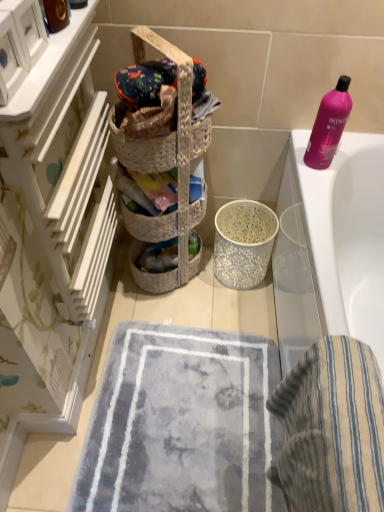
Question: Is white wood drawers at left located outside white glossy bathtub at upper right?

Choices:
 (A) yes
 (B) no

Answer: (A)

Question: From the image's perspective, is white wood drawers at left on white glossy bathtub at upper right?

Choices:
 (A) yes
 (B) no

Answer: (A)

Question: Can you confirm if white wood drawers at left is bigger than white glossy bathtub at upper right?

Choices:
 (A) yes
 (B) no

Answer: (B)

Question: From a real-world perspective, is white wood drawers at left under white glossy bathtub at upper right?

Choices:
 (A) no
 (B) yes

Answer: (A)

Question: Is there a large distance between white wood drawers at left and white glossy bathtub at upper right?

Choices:
 (A) yes
 (B) no

Answer: (B)

Question: Is white wood drawers at left next to white glossy bathtub at upper right and touching it?

Choices:
 (A) yes
 (B) no

Answer: (B)

Question: From the image's perspective, is pink plastic bottle at upper right over woven straw basket at center?

Choices:
 (A) yes
 (B) no

Answer: (A)

Question: From the image's perspective, would you say pink plastic bottle at upper right is shown under woven straw basket at center?

Choices:
 (A) no
 (B) yes

Answer: (A)

Question: Can you confirm if pink plastic bottle at upper right is taller than woven straw basket at center?

Choices:
 (A) no
 (B) yes

Answer: (B)

Question: Can you confirm if pink plastic bottle at upper right is wider than woven straw basket at center?

Choices:
 (A) no
 (B) yes

Answer: (A)

Question: From a real-world perspective, is pink plastic bottle at upper right on woven straw basket at center?

Choices:
 (A) no
 (B) yes

Answer: (A)

Question: Is pink plastic bottle at upper right facing away from woven straw basket at center?

Choices:
 (A) no
 (B) yes

Answer: (A)

Question: Can you confirm if white wood drawers at left is wider than soft gray carpet at center?

Choices:
 (A) yes
 (B) no

Answer: (B)